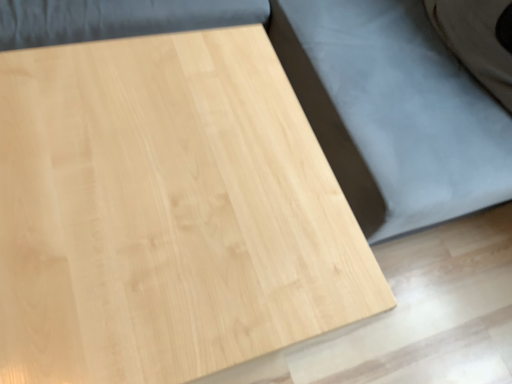
In order to click on free location above light wood table at center (from a real-world perspective) in this screenshot , I will do `click(161, 189)`.